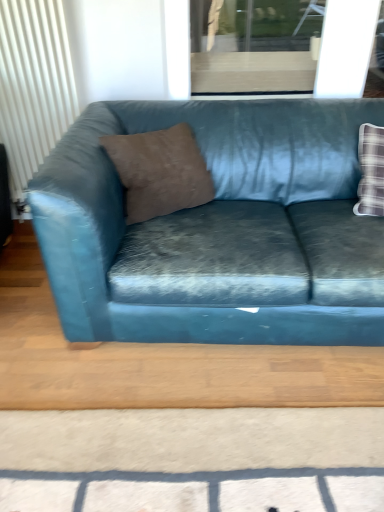
You are a GUI agent. You are given a task and a screenshot of the screen. Output one action in this format:
    pyautogui.click(x=<x>, y=<y>)
    Task: Click on the teal velvet couch at center
    The width and height of the screenshot is (384, 512).
    Given the screenshot: What is the action you would take?
    pyautogui.click(x=218, y=229)

This screenshot has height=512, width=384. What do you see at coordinates (253, 46) in the screenshot? I see `transparent glass window at upper center` at bounding box center [253, 46].

What do you see at coordinates (33, 85) in the screenshot? I see `white textured radiator at left` at bounding box center [33, 85].

Identify the location of brown suede pillow at center. This screenshot has height=512, width=384. (160, 170).

Is transparent glass window at upper center not close to white textured radiator at left?

No, transparent glass window at upper center is not far from white textured radiator at left.

Considering the sizes of transparent glass window at upper center and white textured radiator at left in the image, is transparent glass window at upper center taller or shorter than white textured radiator at left?

transparent glass window at upper center is shorter than white textured radiator at left.

Is transparent glass window at upper center inside or outside of white textured radiator at left?

transparent glass window at upper center cannot be found inside white textured radiator at left.

Is transparent glass window at upper center closer to the viewer compared to white textured radiator at left?

No, transparent glass window at upper center is behind white textured radiator at left.

From the image's perspective, is white textured radiator at left positioned above or below brown suede pillow at center?

Clearly, from the image's perspective, white textured radiator at left is above brown suede pillow at center.

What are the coordinates of `pillow on the right of white textured radiator at left` in the screenshot? It's located at (160, 170).

Considering the relative sizes of white textured radiator at left and transparent glass window at upper center in the image provided, is white textured radiator at left taller than transparent glass window at upper center?

Yes.

From the image's perspective, is white textured radiator at left located above or below transparent glass window at upper center?

Based on their image positions, white textured radiator at left is located beneath transparent glass window at upper center.

Is white textured radiator at left oriented towards transparent glass window at upper center?

No.

Which of these two, white textured radiator at left or transparent glass window at upper center, is wider?

With larger width is white textured radiator at left.

Would you say brown suede pillow at center is inside or outside transparent glass window at upper center?

The correct answer is: outside.

Considering their positions, is brown suede pillow at center located in front of or behind transparent glass window at upper center?

brown suede pillow at center is in front of transparent glass window at upper center.

How much distance is there between brown suede pillow at center and transparent glass window at upper center?

34.82 inches.

Which object is wider, brown suede pillow at center or transparent glass window at upper center?

Wider between the two is brown suede pillow at center.

Which object is wider, teal velvet couch at center or transparent glass window at upper center?

teal velvet couch at center is wider.

From the image's perspective, relative to transparent glass window at upper center, is teal velvet couch at center above or below?

From the image's perspective, teal velvet couch at center appears below transparent glass window at upper center.

Considering the sizes of objects teal velvet couch at center and transparent glass window at upper center in the image provided, who is taller, teal velvet couch at center or transparent glass window at upper center?

Standing taller between the two is teal velvet couch at center.

Is teal velvet couch at center surrounding white textured radiator at left?

That's incorrect, white textured radiator at left is not inside teal velvet couch at center.

Can you see teal velvet couch at center touching white textured radiator at left?

teal velvet couch at center and white textured radiator at left are clearly separated.

From a real-world perspective, is teal velvet couch at center physically located above or below white textured radiator at left?

From a real-world perspective, teal velvet couch at center is physically below white textured radiator at left.

In the scene shown: Is teal velvet couch at center positioned far away from brown suede pillow at center?

No, teal velvet couch at center is not far from brown suede pillow at center.

Looking at this image, considering the relative sizes of teal velvet couch at center and brown suede pillow at center in the image provided, is teal velvet couch at center taller than brown suede pillow at center?

Indeed, teal velvet couch at center has a greater height compared to brown suede pillow at center.

Locate an element on the screen. The image size is (384, 512). radiator to the left of transparent glass window at upper center is located at coordinates (33, 85).

Where is `pillow that appears in front of the white textured radiator at left`? This screenshot has width=384, height=512. pillow that appears in front of the white textured radiator at left is located at coordinates (160, 170).

Estimate the real-world distances between objects in this image. Which object is closer to brown suede pillow at center, teal velvet couch at center or transparent glass window at upper center?

The object closer to brown suede pillow at center is teal velvet couch at center.

Considering their positions, is teal velvet couch at center positioned further to white textured radiator at left than brown suede pillow at center?

teal velvet couch at center is positioned further to the anchor white textured radiator at left.

Estimate the real-world distances between objects in this image. Which object is further from transparent glass window at upper center, teal velvet couch at center or brown suede pillow at center?

brown suede pillow at center.

From the picture: Looking at the image, which one is located further to white textured radiator at left, brown suede pillow at center or teal velvet couch at center?

teal velvet couch at center is positioned further to the anchor white textured radiator at left.

Based on their spatial positions, is white textured radiator at left or teal velvet couch at center further from transparent glass window at upper center?

white textured radiator at left is further to transparent glass window at upper center.

Looking at the image, which one is located further to teal velvet couch at center, transparent glass window at upper center or white textured radiator at left?

Based on the image, white textured radiator at left appears to be further to teal velvet couch at center.

Looking at the image, which one is located closer to teal velvet couch at center, white textured radiator at left or transparent glass window at upper center?

The object closer to teal velvet couch at center is transparent glass window at upper center.

Consider the image. Estimate the real-world distances between objects in this image. Which object is further from brown suede pillow at center, white textured radiator at left or transparent glass window at upper center?

transparent glass window at upper center is further to brown suede pillow at center.

Identify the location of pillow located between white textured radiator at left and teal velvet couch at center in the left-right direction. (160, 170).

Locate an element on the screen. Image resolution: width=384 pixels, height=512 pixels. pillow between white textured radiator at left and transparent glass window at upper center in the horizontal direction is located at coordinates (160, 170).

Where is `pillow between transparent glass window at upper center and teal velvet couch at center from top to bottom`? This screenshot has width=384, height=512. pillow between transparent glass window at upper center and teal velvet couch at center from top to bottom is located at coordinates (160, 170).

What are the coordinates of `studio couch between white textured radiator at left and transparent glass window at upper center from left to right` in the screenshot? It's located at (218, 229).